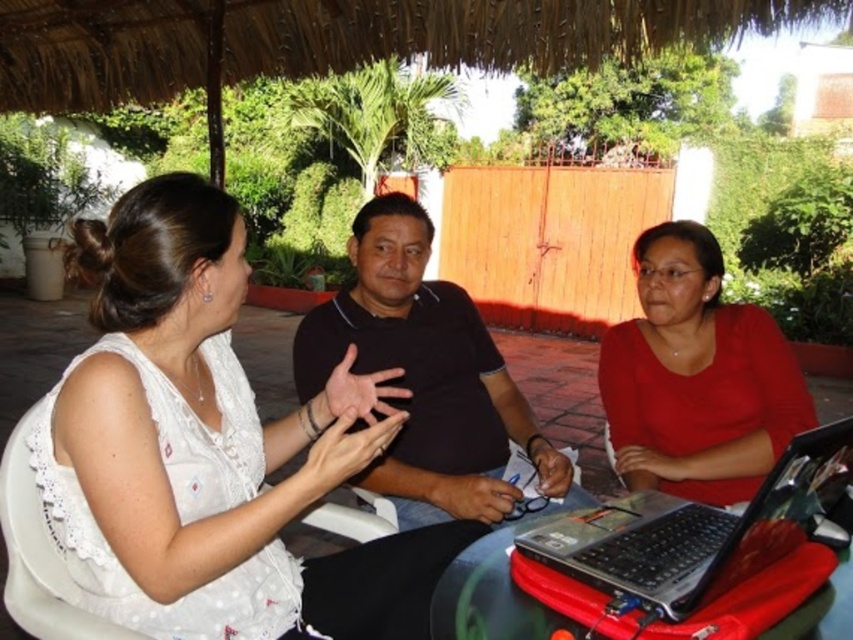
A photographer wants to take a picture of the scene from the camera position. The photographer needs to ensure that the subject at point (460,449) is in focus. Given that the camera has a depth of field that can sharply focus subjects within 1.5 meters, will the subject be in focus?

The distance between the point (460,449) and the camera is 1.76 meters. Since the depth of field can only focus within 1.5 meters, the subject will not be in focus.